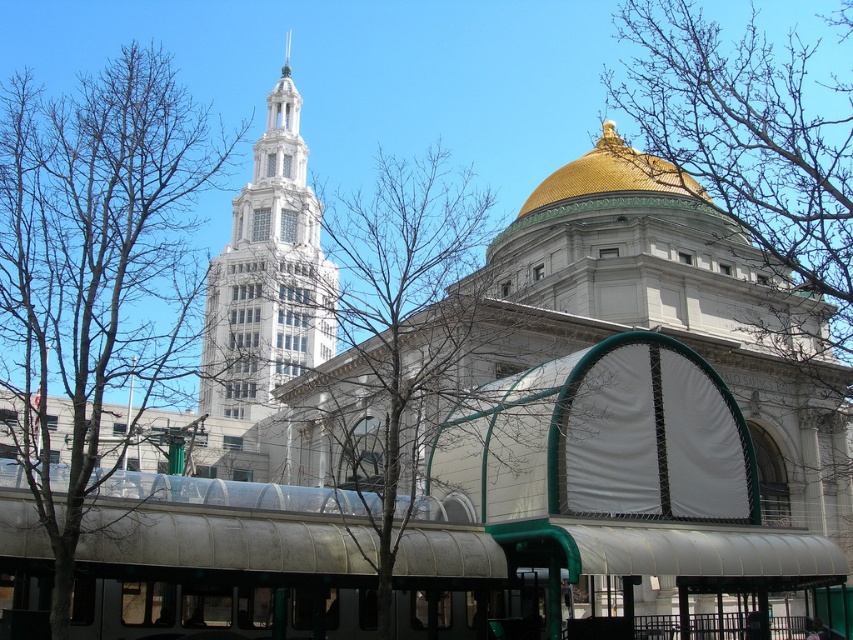
You are standing in the city and see the bare branches at center. If you want to take a photo of them with your phone, which has a maximum zoom range of 10 meters, will you be able to capture them clearly without moving closer?

The bare branches at center are 37.10 meters away from you. Since your phone has a maximum zoom range of 10 meters, you cannot capture them clearly without moving closer.

You are an urban planner reviewing a city layout. You notice two sets of bare branches in the image. Which set is located to the left of the other? The options are the bare branches at center and the bare branches at upper right.

The bare branches at center is positioned on the left side of bare branches at upper right.

You are an architect observing the cityscape. You notice the bare branches at center and the gold metallic dome at upper center. Which object is positioned higher in the scene?

The gold metallic dome at upper center is positioned higher than the bare branches at center.